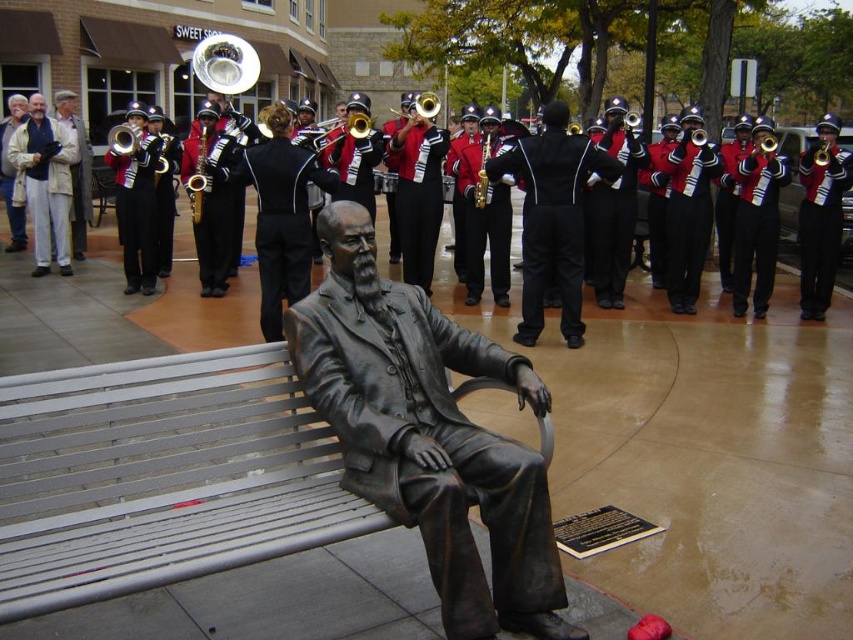
You are a photographer planning to take a photo of the bronze statue at center and the silver metallic bench at center. Based on their heights, which object should you focus on first if you want to ensure both are in frame without any part being cut off?

The silver metallic bench at center is not as tall as the bronze statue at center. Therefore, you should focus on the bronze statue at center first to ensure its full height is captured in the frame, as it is taller and requires more space vertically.

You are a photographer trying to capture a clear shot of both the shiny gold trumpet at center and the bronze saxophone at center. Since you want both instruments to be in focus, you need to know their positions relative to each other. Which one is positioned to the right side?

The shiny gold trumpet at center is to the right of the bronze saxophone at center.

You are a photographer standing in front of the statue of the seated man. You notice two instruments in the center of the scene. Which instrument is shorter in height between the shiny gold trumpet at center and the bronze saxophone at center?

The shiny gold trumpet at center has a lesser height compared to the bronze saxophone at center, so the shiny gold trumpet at center is shorter in height.